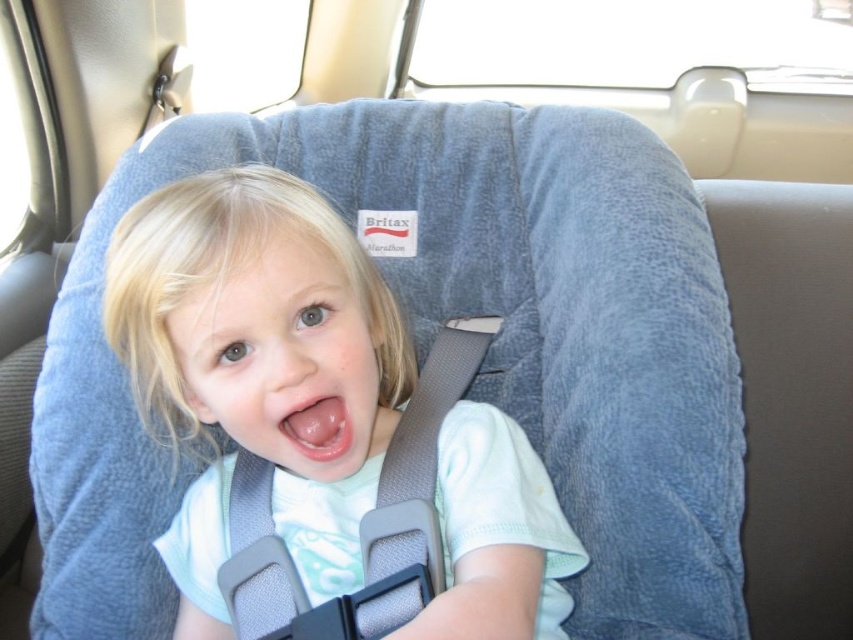
You are a parent preparing to buckle your child into the matte gray car seat at center. You need to ensure there is enough space between your child and the car seat to safely fasten the harness. Considering the distance between you and the car seat, is the current distance sufficient for you to comfortably adjust the harness?

The distance between the matte gray car seat at center and the viewer is 22.53 inches, which provides enough space to comfortably adjust the harness.

You are a safety inspector checking the car seat installation. You notice the pink glossy tongue at center and the matte gray car seat at center. Which object is taller?

The matte gray car seat at center is taller than the pink glossy tongue at center.

You are a passenger in the car and want to reach both the point at coordinates point [480,634] and point [323,436] in the car. Which point will you reach first if you extend your arm straight out?

Point [480,634] is closer to the viewer than point [323,436], so you will reach point [480,634] first.